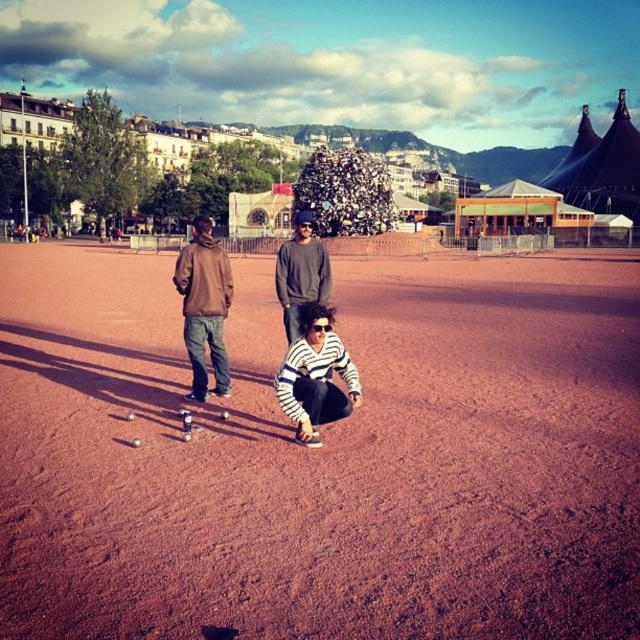
Question: Based on their relative distances, which object is farther from the striped fabric at center?

Choices:
 (A) brown matte jacket at left
 (B) brown dirt field at center

Answer: (B)

Question: Can you confirm if striped fabric at center is positioned to the left of brown matte jacket at left?

Choices:
 (A) no
 (B) yes

Answer: (A)

Question: Which of the following is the farthest from the observer?

Choices:
 (A) striped fabric at center
 (B) brown dirt field at center
 (C) gray sweater at center
 (D) brown matte jacket at left

Answer: (D)

Question: Does striped fabric at center appear on the right side of gray sweater at center?

Choices:
 (A) no
 (B) yes

Answer: (B)

Question: Does striped fabric at center appear under brown matte jacket at left?

Choices:
 (A) no
 (B) yes

Answer: (B)

Question: Which point is closer to the camera?

Choices:
 (A) coord(316,372)
 (B) coord(568,420)
 (C) coord(304,282)

Answer: (B)